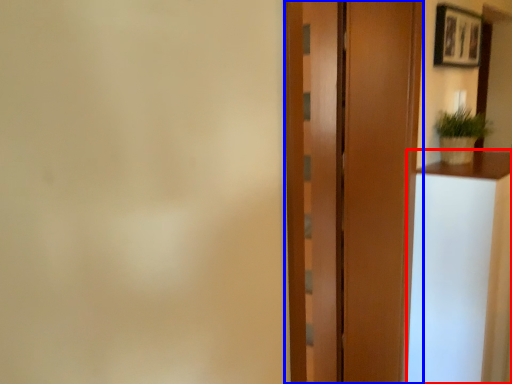
Question: Which point is closer to the camera, vanity (highlighted by a red box) or door (highlighted by a blue box)?

Choices:
 (A) vanity
 (B) door

Answer: (B)